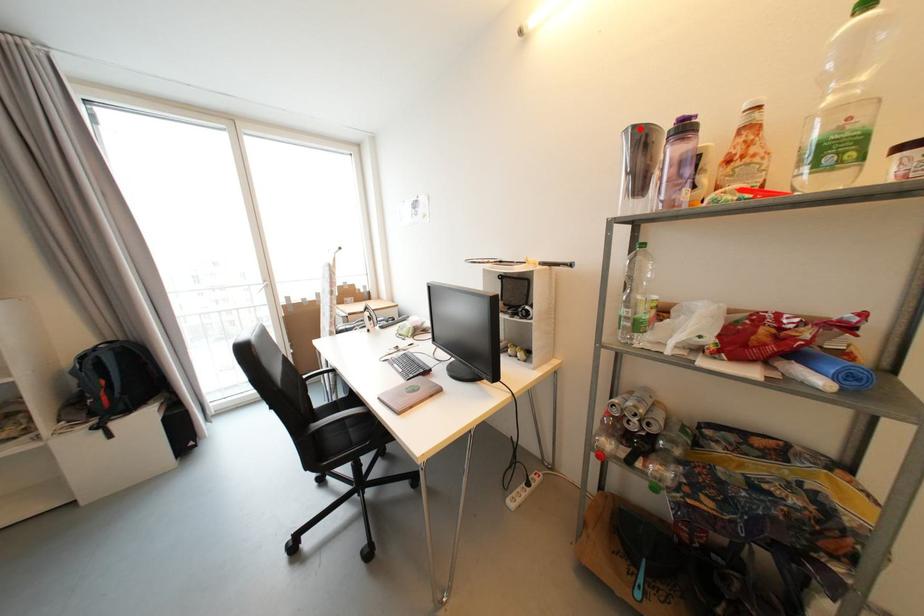
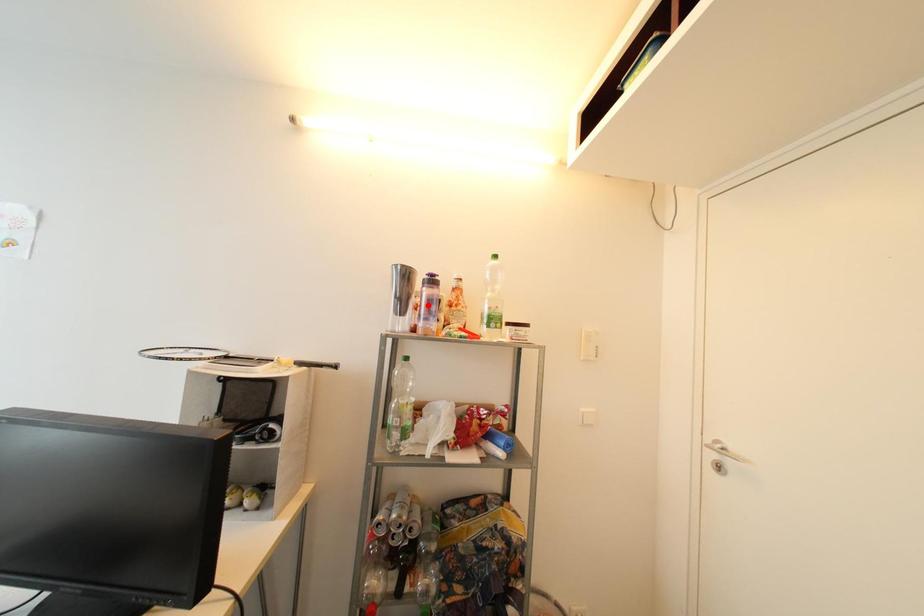
I am providing you with two images of the same scene from different viewpoints. A red point is marked on the first image and another point is marked on the second image. Are the points marked in image1 and image2 representing the same 3D position?

No